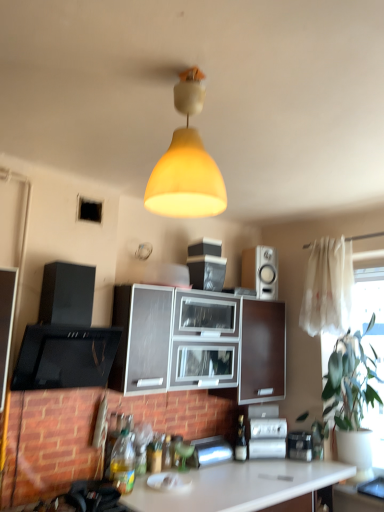
Question: Which direction should I rotate to look at metallic silver toaster at lower center, which is the 3th appliance from right to left, — up or down?

Choices:
 (A) down
 (B) up

Answer: (A)

Question: Is metallic silver toaster at lower center, which is the 3th appliance from right to left, located within white sheer curtain at right?

Choices:
 (A) no
 (B) yes

Answer: (A)

Question: Does white sheer curtain at right lie behind metallic silver toaster at lower center, placed as the 1th appliance when sorted from left to right?

Choices:
 (A) yes
 (B) no

Answer: (A)

Question: Considering the relative positions of white sheer curtain at right and metallic silver toaster at lower center, placed as the 1th appliance when sorted from left to right, in the image provided, is white sheer curtain at right to the right of metallic silver toaster at lower center, placed as the 1th appliance when sorted from left to right, from the viewer's perspective?

Choices:
 (A) no
 (B) yes

Answer: (B)

Question: Can you confirm if white sheer curtain at right is shorter than metallic silver toaster at lower center, placed as the 1th appliance when sorted from left to right?

Choices:
 (A) no
 (B) yes

Answer: (A)

Question: Is white sheer curtain at right facing towards metallic silver toaster at lower center, which is the 3th appliance from right to left?

Choices:
 (A) yes
 (B) no

Answer: (B)

Question: Is metallic silver toaster at lower center, which is the 3th appliance from right to left, at the back of white sheer curtain at right?

Choices:
 (A) no
 (B) yes

Answer: (A)

Question: Can you confirm if white glossy countertop at lower center is positioned to the left of yellow matte lampshade at center?

Choices:
 (A) no
 (B) yes

Answer: (A)

Question: Is white glossy countertop at lower center oriented away from yellow matte lampshade at center?

Choices:
 (A) no
 (B) yes

Answer: (A)

Question: Considering the relative sizes of white glossy countertop at lower center and yellow matte lampshade at center in the image provided, is white glossy countertop at lower center smaller than yellow matte lampshade at center?

Choices:
 (A) no
 (B) yes

Answer: (A)

Question: From a real-world perspective, is white glossy countertop at lower center over yellow matte lampshade at center?

Choices:
 (A) yes
 (B) no

Answer: (B)

Question: Does white glossy countertop at lower center appear on the right side of yellow matte lampshade at center?

Choices:
 (A) yes
 (B) no

Answer: (A)

Question: Considering the relative sizes of white glossy countertop at lower center and yellow matte lampshade at center in the image provided, is white glossy countertop at lower center shorter than yellow matte lampshade at center?

Choices:
 (A) yes
 (B) no

Answer: (B)

Question: Can you confirm if green leafy plant at right is bigger than white glossy speaker at upper right?

Choices:
 (A) no
 (B) yes

Answer: (B)